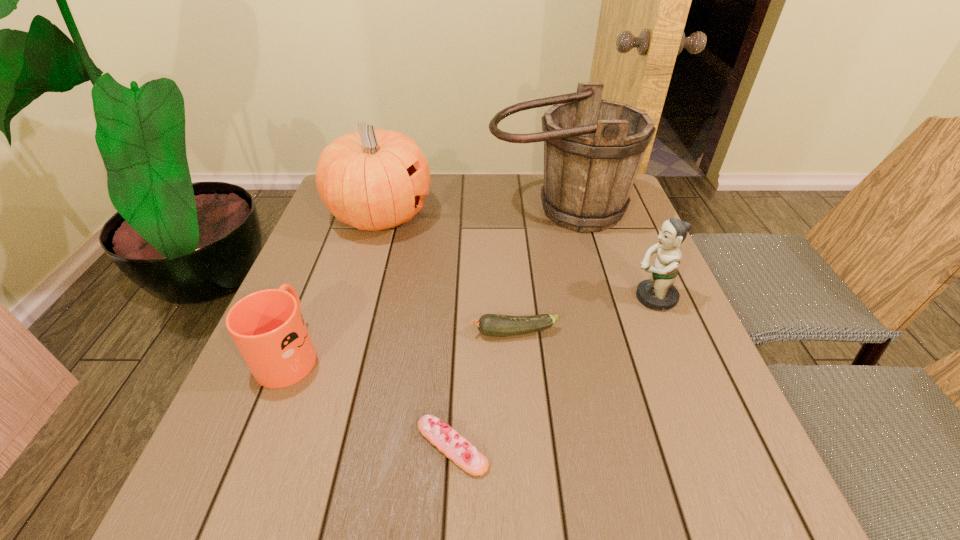
You are a GUI agent. You are given a task and a screenshot of the screen. Output one action in this format:
    pyautogui.click(x=<x>, y=<y>)
    Task: Click on the unoccupied area between the fourth tallest object and the pumpkin
    Image resolution: width=960 pixels, height=540 pixels.
    Given the screenshot: What is the action you would take?
    pyautogui.click(x=335, y=284)

Where is `free space between the figurine and the zucchini`? Image resolution: width=960 pixels, height=540 pixels. free space between the figurine and the zucchini is located at coordinates (584, 315).

Locate an element on the screen. Image resolution: width=960 pixels, height=540 pixels. the fifth closest object to the bucket is located at coordinates (454, 446).

Where is `object that is the closest to the pumpkin`? The image size is (960, 540). object that is the closest to the pumpkin is located at coordinates (593, 148).

The width and height of the screenshot is (960, 540). What are the coordinates of `free space in the image that satisfies the following two spatial constraints: 1. on the handle side of the bucket; 2. on the front-facing side of the pumpkin` in the screenshot? It's located at (560, 215).

Locate an element on the screen. free location that satisfies the following two spatial constraints: 1. on the front-facing side of the eclair; 2. on the left side of the pumpkin is located at coordinates (312, 446).

Where is `vacant space that satisfies the following two spatial constraints: 1. on the front-facing side of the pumpkin; 2. on the left side of the shortest object`? This screenshot has width=960, height=540. vacant space that satisfies the following two spatial constraints: 1. on the front-facing side of the pumpkin; 2. on the left side of the shortest object is located at coordinates (312, 446).

The image size is (960, 540). What are the coordinates of `free region that satisfies the following two spatial constraints: 1. on the front-facing side of the fourth shortest object; 2. on the front side of the nearest object` in the screenshot? It's located at (714, 446).

Identify the location of vacant point that satisfies the following two spatial constraints: 1. on the front-facing side of the pumpkin; 2. on the back side of the shortest object. This screenshot has height=540, width=960. (312, 446).